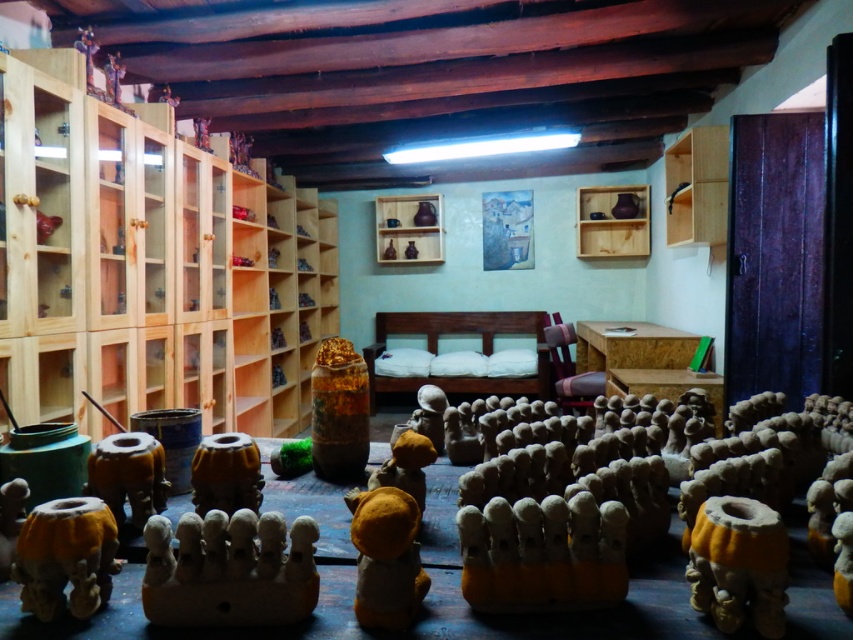
You are an artist entering the workshop and need to place a new ceramic bowl on the shelf. The bowl is slightly larger than the translucent amber vase at center. Can you fit it on the matte wood shelf at center without moving the vase?

The translucent amber vase at center is closer to the viewer than the matte wood shelf at center. Since the bowl is larger than the vase, but the description does not provide information about the size of the matte wood shelf at center, it is unclear if there is enough space. However, since the vase is closer, the shelf might be behind it, so moving the vase might be necessary to access the shelf. Therefore, without moving the vase, it might not be possible to place the bowl on the matte wood shelf at the

You are a pottery artist who wants to place a new ceramic bowl on the matte wood shelf at center. The bowl is the same size as the matte brown vase at center. Will it fit on the shelf?

The matte brown vase at center is smaller than the matte wood shelf at center. Since the bowl is the same size as the vase, it should fit on the shelf.

You are organizing a display in the workshop and want to place the yellow felt toy at center on top of the wooden shelf at upper center. Based on their sizes, will the toy fit comfortably without overhanging the edges?

The yellow felt toy at center is smaller than the wooden shelf at upper center, so it should fit comfortably without overhanging the edges.